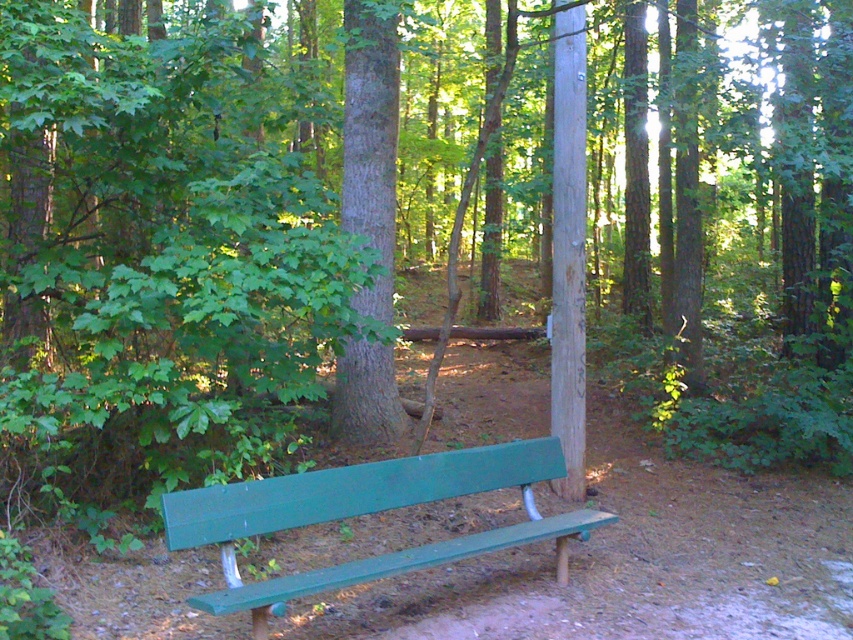
Question: Which point appears farthest from the camera in this image?

Choices:
 (A) (374, 353)
 (B) (402, 570)

Answer: (A)

Question: From the image, what is the correct spatial relationship of green painted wood bench at center in relation to green rough bark tree at center?

Choices:
 (A) above
 (B) below

Answer: (B)

Question: Does green painted wood bench at center appear over green rough bark tree at center?

Choices:
 (A) yes
 (B) no

Answer: (B)

Question: Among these points, which one is farthest from the camera?

Choices:
 (A) (378, 108)
 (B) (286, 529)

Answer: (A)

Question: Does green painted wood bench at center come in front of green rough bark tree at center?

Choices:
 (A) no
 (B) yes

Answer: (B)